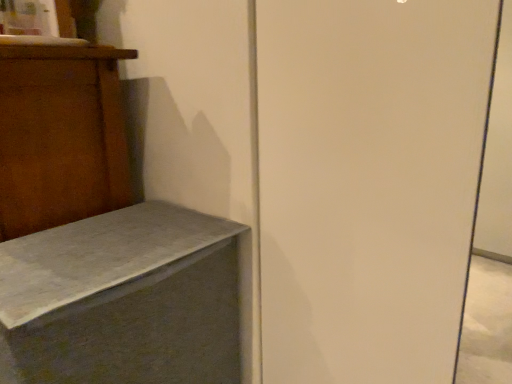
Question: Is white matte screen door at center positioned before matte gray concrete bench at lower left?

Choices:
 (A) no
 (B) yes

Answer: (B)

Question: Is white matte screen door at center positioned with its back to matte gray concrete bench at lower left?

Choices:
 (A) no
 (B) yes

Answer: (A)

Question: From the image's perspective, is white matte screen door at center located above matte gray concrete bench at lower left?

Choices:
 (A) no
 (B) yes

Answer: (B)

Question: Can you confirm if white matte screen door at center is shorter than matte gray concrete bench at lower left?

Choices:
 (A) yes
 (B) no

Answer: (B)

Question: Does white matte screen door at center have a greater width compared to matte gray concrete bench at lower left?

Choices:
 (A) yes
 (B) no

Answer: (B)

Question: From a real-world perspective, is white matte screen door at center physically below matte gray concrete bench at lower left?

Choices:
 (A) no
 (B) yes

Answer: (A)

Question: Can you confirm if matte gray concrete bench at lower left is shorter than white matte screen door at center?

Choices:
 (A) yes
 (B) no

Answer: (A)

Question: Is matte gray concrete bench at lower left placed right next to white matte screen door at center?

Choices:
 (A) no
 (B) yes

Answer: (A)

Question: Can you confirm if matte gray concrete bench at lower left is smaller than white matte screen door at center?

Choices:
 (A) yes
 (B) no

Answer: (B)

Question: Considering the relative sizes of matte gray concrete bench at lower left and white matte screen door at center in the image provided, is matte gray concrete bench at lower left wider than white matte screen door at center?

Choices:
 (A) no
 (B) yes

Answer: (B)

Question: Is matte gray concrete bench at lower left oriented away from white matte screen door at center?

Choices:
 (A) no
 (B) yes

Answer: (A)

Question: Considering the relative positions of matte gray concrete bench at lower left and white matte screen door at center in the image provided, is matte gray concrete bench at lower left to the right of white matte screen door at center from the viewer's perspective?

Choices:
 (A) yes
 (B) no

Answer: (B)

Question: Considering the positions of point (134, 215) and point (378, 82), is point (134, 215) closer or farther from the camera than point (378, 82)?

Choices:
 (A) farther
 (B) closer

Answer: (A)